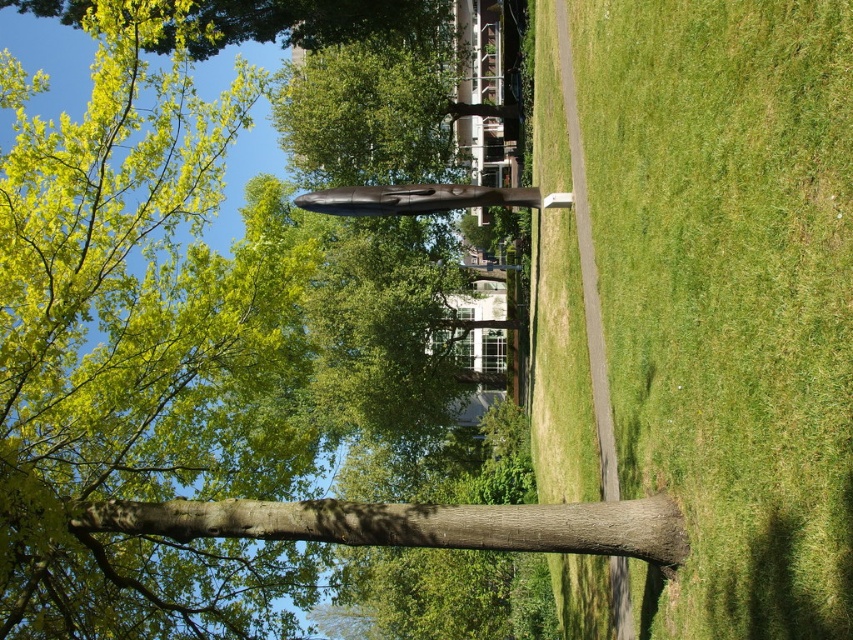
Can you confirm if green grass at center is positioned below brown rough tree trunk at center?

Actually, green grass at center is above brown rough tree trunk at center.

Who is shorter, green grass at center or brown rough tree trunk at center?

Standing shorter between the two is brown rough tree trunk at center.

Who is more distant from viewer, (802, 26) or (546, 508)?

The point (546, 508) is behind.

Where is `green grass at center`? green grass at center is located at coordinates (728, 296).